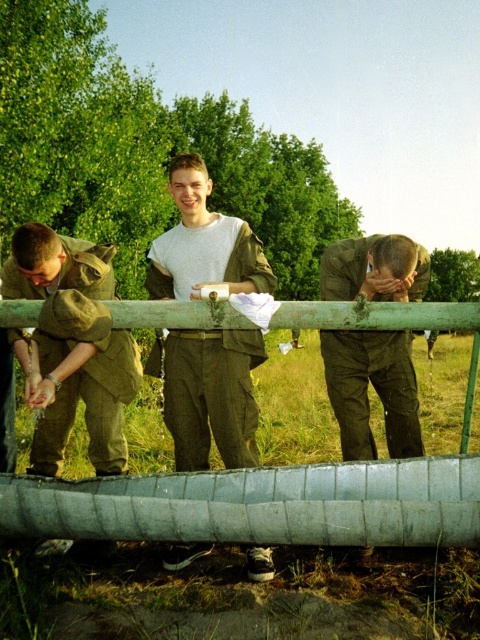
Measure the distance from gray rubber canoe at center to matte khaki pants at center.

gray rubber canoe at center is 73.10 centimeters away from matte khaki pants at center.

Who is more forward, (146, 508) or (253, 442)?

Positioned in front is point (146, 508).

The height and width of the screenshot is (640, 480). I want to click on gray rubber canoe at center, so click(x=260, y=504).

Does matte khaki pants at center have a lesser width compared to matte olive green uniform at center?

No.

Which is more to the left, matte khaki pants at center or matte olive green uniform at center?

matte khaki pants at center is more to the left.

Does point (175, 173) come behind point (332, 336)?

No, (175, 173) is in front of (332, 336).

Image resolution: width=480 pixels, height=640 pixels. I want to click on matte khaki pants at center, so click(210, 394).

Based on the photo, is gray rubber canoe at center further to the viewer compared to matte olive green uniform at center?

Yes, gray rubber canoe at center is behind matte olive green uniform at center.

Does point (420, 460) come in front of point (351, 403)?

No, it is behind (351, 403).

Is point (54, 506) farther from viewer compared to point (346, 280)?

No, (54, 506) is in front of (346, 280).

This screenshot has height=640, width=480. What are the coordinates of `gray rubber canoe at center` in the screenshot? It's located at (260, 504).